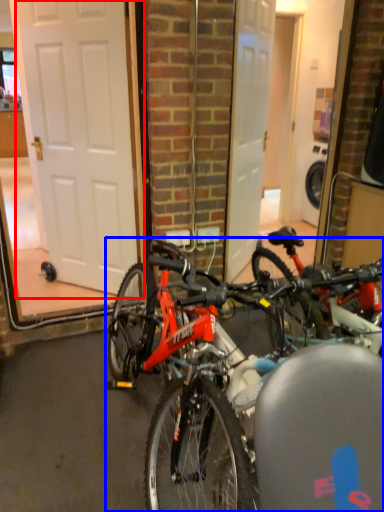
Question: Which of the following is the closest to the observer, door (highlighted by a red box) or bicycle (highlighted by a blue box)?

Choices:
 (A) door
 (B) bicycle

Answer: (B)